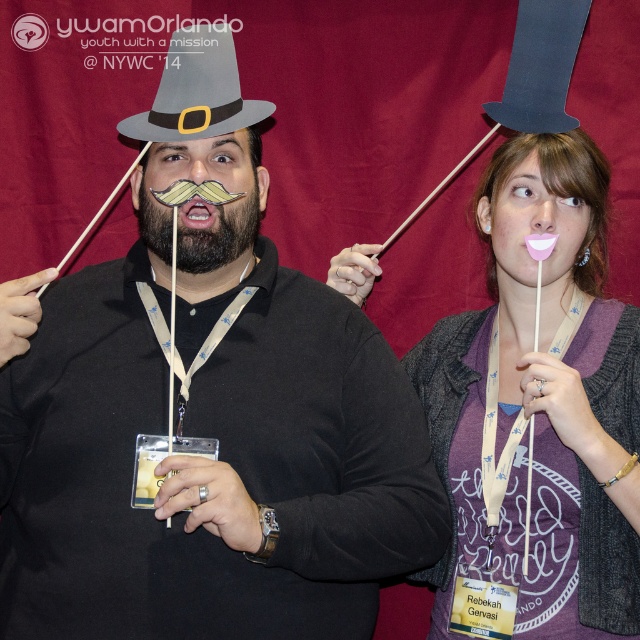
Question: Considering the real-world distances, which object is closest to the purple matte shirt at center?

Choices:
 (A) brownwoodybeard at center
 (B) gray felt hat at upper center
 (C) matte gray hat at center

Answer: (C)

Question: Which point is farther to the camera?

Choices:
 (A) [179, 72]
 (B) [449, 376]
 (C) [259, 208]

Answer: (B)

Question: From the image, what is the correct spatial relationship of matte gray hat at center in relation to brownwoodybeard at center?

Choices:
 (A) right
 (B) left

Answer: (A)

Question: Which object appears farthest from the camera in this image?

Choices:
 (A) matte gray hat at center
 (B) purple matte shirt at center

Answer: (B)

Question: Can you confirm if matte gray hat at center is positioned above purple matte shirt at center?

Choices:
 (A) no
 (B) yes

Answer: (A)

Question: Does purple matte shirt at center appear over brownwoodybeard at center?

Choices:
 (A) yes
 (B) no

Answer: (B)